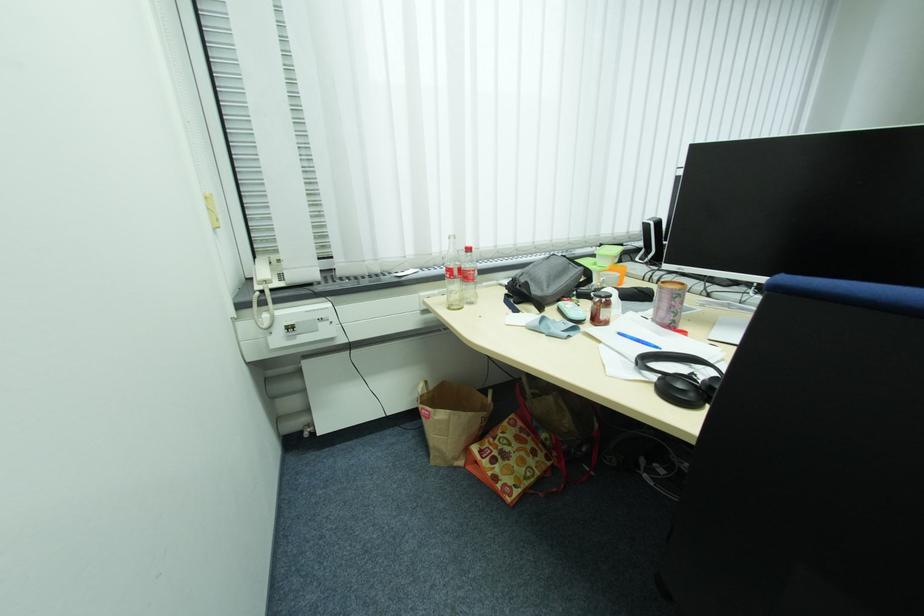
This screenshot has width=924, height=616. Describe the element at coordinates (261, 272) in the screenshot. I see `the white telephone handset` at that location.